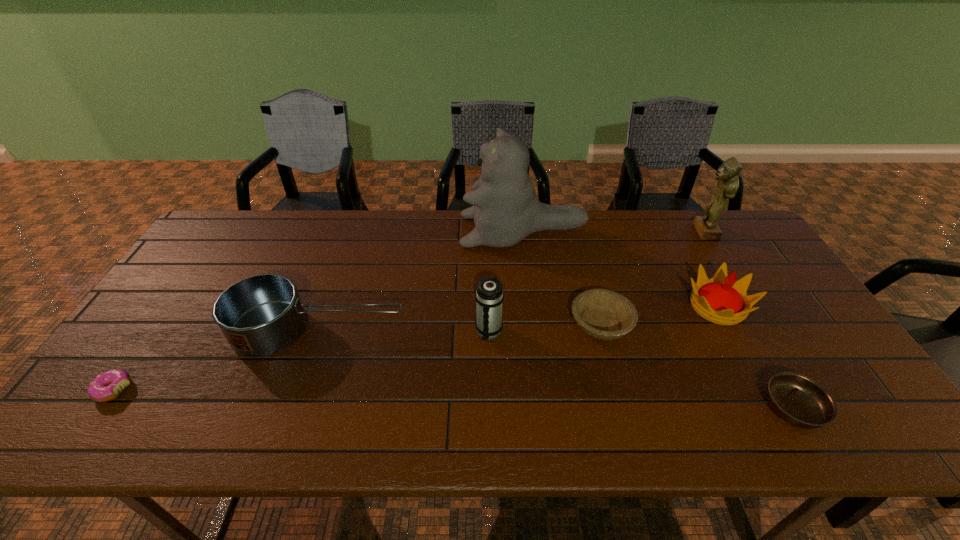
The width and height of the screenshot is (960, 540). I want to click on free region located 0.340m on the face of the cat, so click(x=360, y=231).

In order to click on vacant space located on the face of the cat in this screenshot , I will do `click(396, 231)`.

Where is `vacant space situated on the face of the cat`? The image size is (960, 540). vacant space situated on the face of the cat is located at coordinates (413, 231).

The image size is (960, 540). What are the coordinates of `free region located 0.240m on the front-facing side of the figurine` in the screenshot? It's located at (622, 232).

In order to click on free space located 0.160m on the front-facing side of the figurine in this screenshot , I will do `click(645, 232)`.

The height and width of the screenshot is (540, 960). What are the coordinates of `vacant space located on the front-facing side of the figurine` in the screenshot? It's located at (601, 232).

You are a GUI agent. You are given a task and a screenshot of the screen. Output one action in this format:
    pyautogui.click(x=<x>, y=<y>)
    Task: Click on the vacant space located on the side with the handle of the thermos bottle
    The width and height of the screenshot is (960, 540).
    Given the screenshot: What is the action you would take?
    pyautogui.click(x=491, y=441)

Identify the location of vacant space located on the back of the crown. The image size is (960, 540). (674, 226).

At what (x,y) coordinates should I click in order to perform the action: click on vacant area located with the handle extending from one side of the seventh object from right to left. Please return your answer as a coordinate pair (x, y). This screenshot has height=540, width=960. Looking at the image, I should click on (484, 330).

Locate an element on the screen. This screenshot has width=960, height=540. vacant space located 0.140m on the back of the bowl is located at coordinates (587, 269).